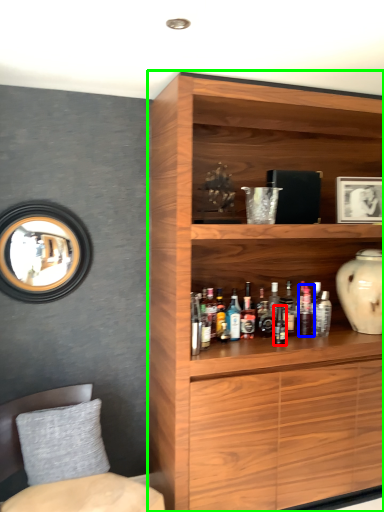
Question: Which is farther away from bottle (highlighted by a red box)? bottle (highlighted by a blue box) or cupboard (highlighted by a green box)?

Choices:
 (A) bottle
 (B) cupboard

Answer: (B)